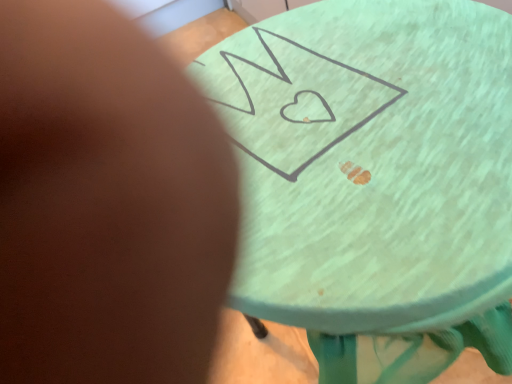
What do you see at coordinates (374, 179) in the screenshot? This screenshot has width=512, height=384. I see `green painted wood table at center` at bounding box center [374, 179].

Locate an element on the screen. green painted wood table at center is located at coordinates (374, 179).

The height and width of the screenshot is (384, 512). Find the location of `green painted wood table at center`. green painted wood table at center is located at coordinates (374, 179).